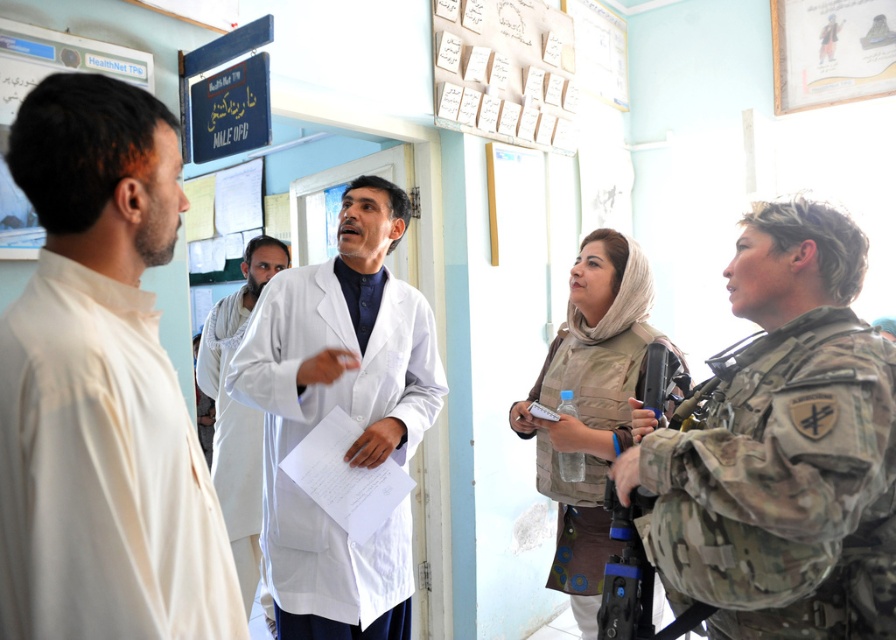
You are a visitor in this medical facility and need to approach the person in the camouflage fabric uniform at right to ask a question. Which direction should you move relative to the white lab coat at left?

To reach the camouflage fabric uniform at right, you should move towards the right side of the white lab coat at left since the camouflage fabric uniform at right is positioned to the right of the white lab coat at left.

You are a visitor in the medical facility and see both the camouflage vest at center and the white cotton lab coat at center. Which one is positioned to the right side from your perspective?

The camouflage vest at center is positioned to the right of the white cotton lab coat at center, so it is the one on the right side.

In the medical facility scene, there is a man in a white lab coat at center and a woman in military uniform. Which object is located at the point with coordinates (343, 410)?

The point at coordinates (343, 410) marks the white lab coat at center.